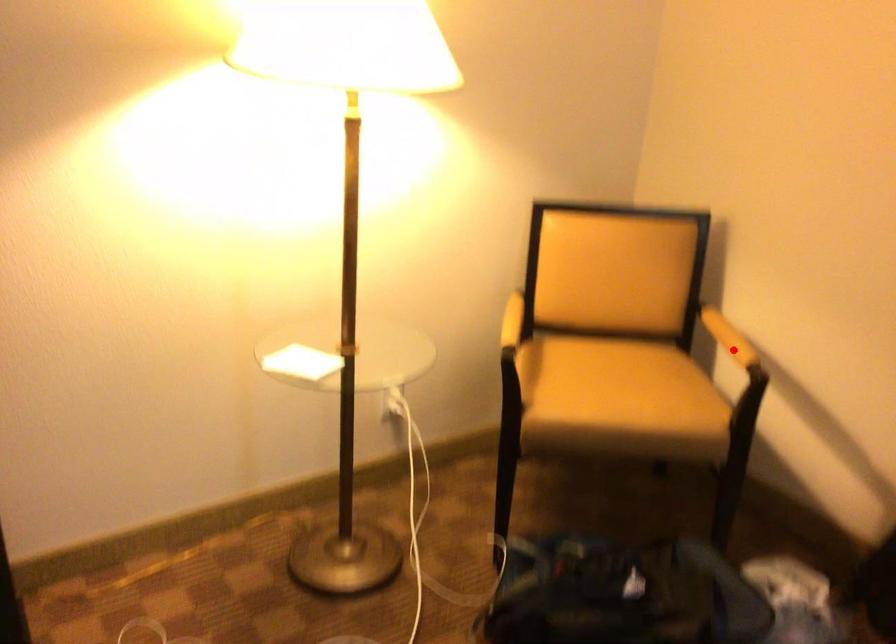
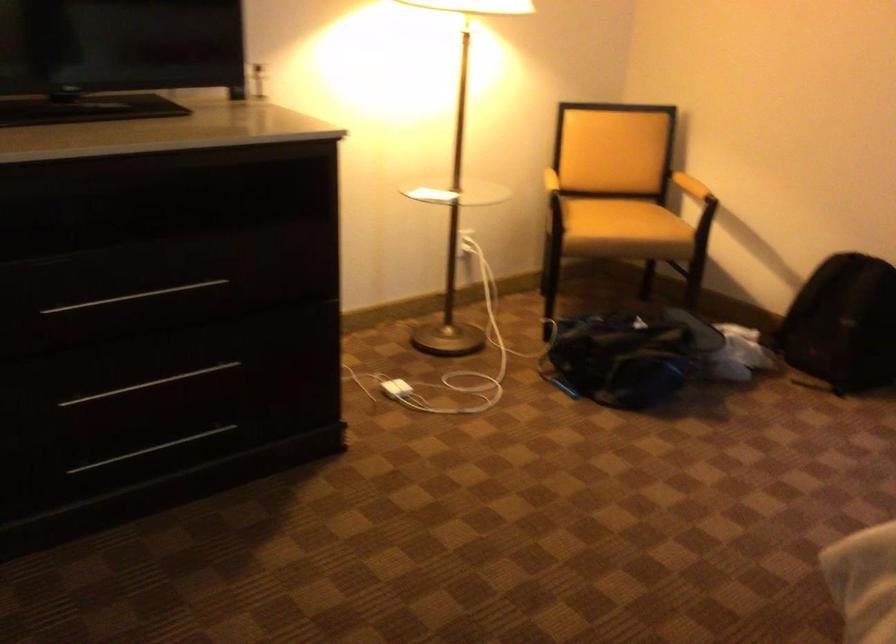
Question: I am providing you with two images of the same scene from different viewpoints. A red point is marked on the first image. Is the red point's position out of view in image 2?

Choices:
 (A) Yes
 (B) No

Answer: (B)